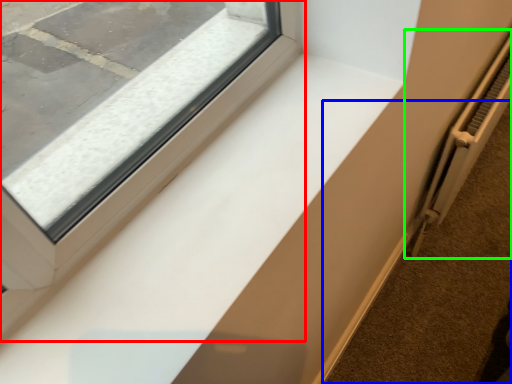
Question: Based on their relative distances, which object is nearer to window (highlighted by a red box)? Choose from pavement (highlighted by a blue box) and radiator (highlighted by a green box).

Choices:
 (A) pavement
 (B) radiator

Answer: (B)